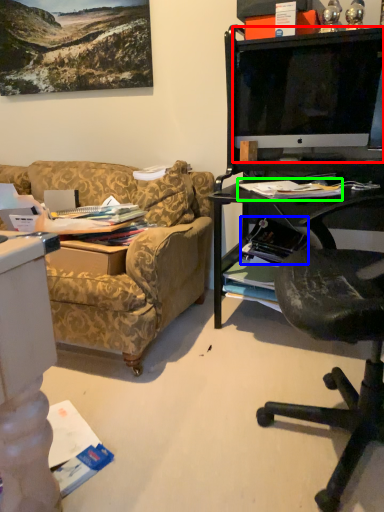
Question: Which is nearer to the television (highlighted by a red box)? magazine (highlighted by a blue box) or magazine (highlighted by a green box).

Choices:
 (A) magazine
 (B) magazine

Answer: (B)